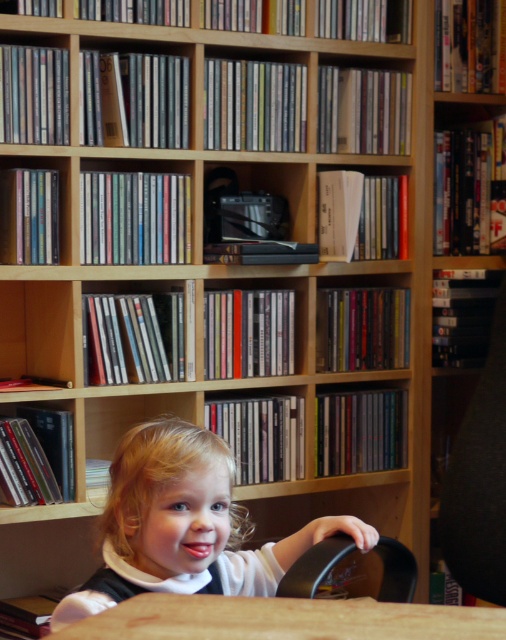
Question: Considering the real-world distances, which object is closest to the black plastic chair at lower center?

Choices:
 (A) blonde hair toddler at center
 (B) brown wooden table at lower center

Answer: (A)

Question: Which object is closer to the camera taking this photo?

Choices:
 (A) blonde hair toddler at center
 (B) black plastic chair at lower center

Answer: (A)

Question: Considering the real-world distances, which object is farthest from the black plastic chair at lower center?

Choices:
 (A) blonde hair toddler at center
 (B) brown wooden table at lower center

Answer: (B)

Question: Can you confirm if blonde hair toddler at center is bigger than brown wooden table at lower center?

Choices:
 (A) yes
 (B) no

Answer: (A)

Question: Considering the relative positions of blonde hair toddler at center and brown wooden table at lower center in the image provided, where is blonde hair toddler at center located with respect to brown wooden table at lower center?

Choices:
 (A) below
 (B) above

Answer: (B)

Question: Where is brown wooden table at lower center located in relation to black plastic chair at lower center in the image?

Choices:
 (A) right
 (B) left

Answer: (B)